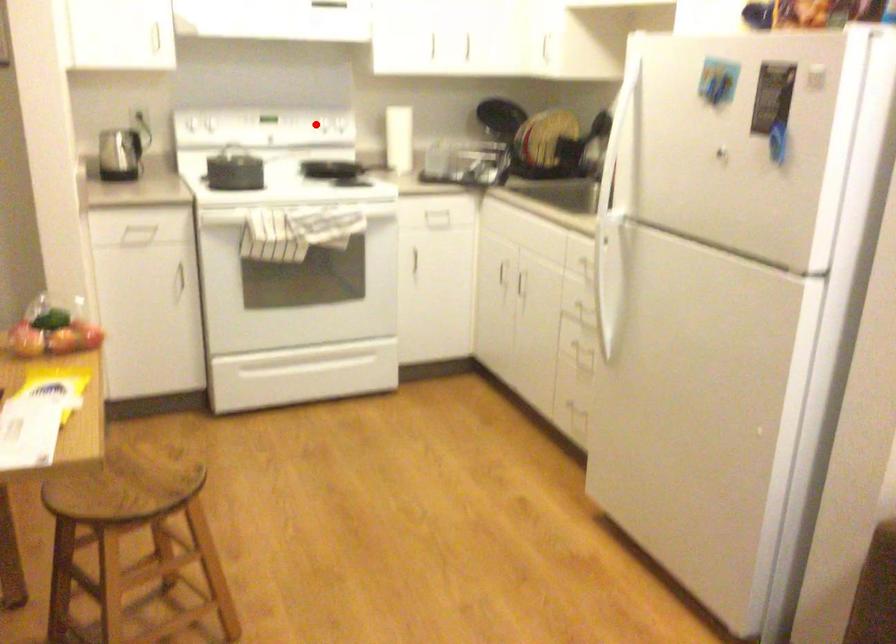
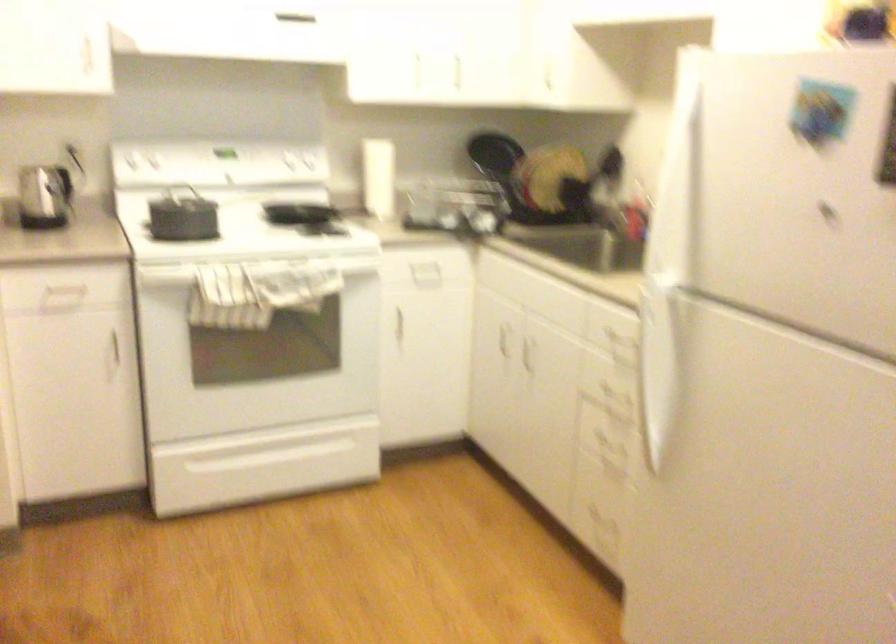
Find the pixel in the second image that matches the highlighted location in the first image.

(283, 169)